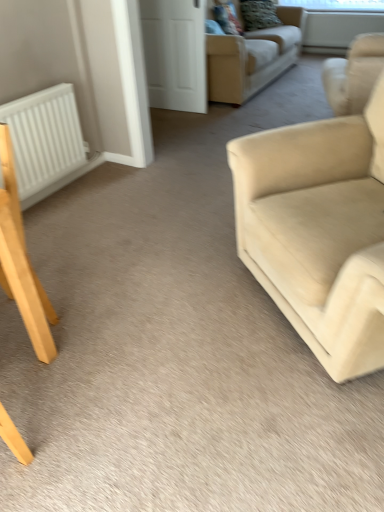
Question: Is velvet textured pillow at upper center spatially inside white matte door at upper center, or outside of it?

Choices:
 (A) outside
 (B) inside

Answer: (A)

Question: From a real-world perspective, relative to white matte door at upper center, is velvet textured pillow at upper center vertically above or below?

Choices:
 (A) above
 (B) below

Answer: (A)

Question: Which object is positioned farthest from the white matte radiator at left?

Choices:
 (A) white matte door at upper center
 (B) light brown wooden chair at lower left
 (C) beige fabric couch at upper center, which appears as the first studio couch when viewed from the top
 (D) beige fabric couch at right, the second studio couch positioned from the top
 (E) transparent glass window screen at upper center, acting as the second window screen starting from the top

Answer: (E)

Question: Considering the real-world distances, which object is farthest from the velvet textured pillow at upper center?

Choices:
 (A) beige fabric couch at right, the first studio couch when ordered from front to back
 (B) beige fabric couch at upper center, which appears as the first studio couch when viewed from the top
 (C) light brown wooden chair at lower left
 (D) transparent glass window screen at upper center, acting as the second window screen starting from the top
 (E) transparent plastic window screen at upper center, marked as the 1th window screen in a top-to-bottom arrangement

Answer: (C)